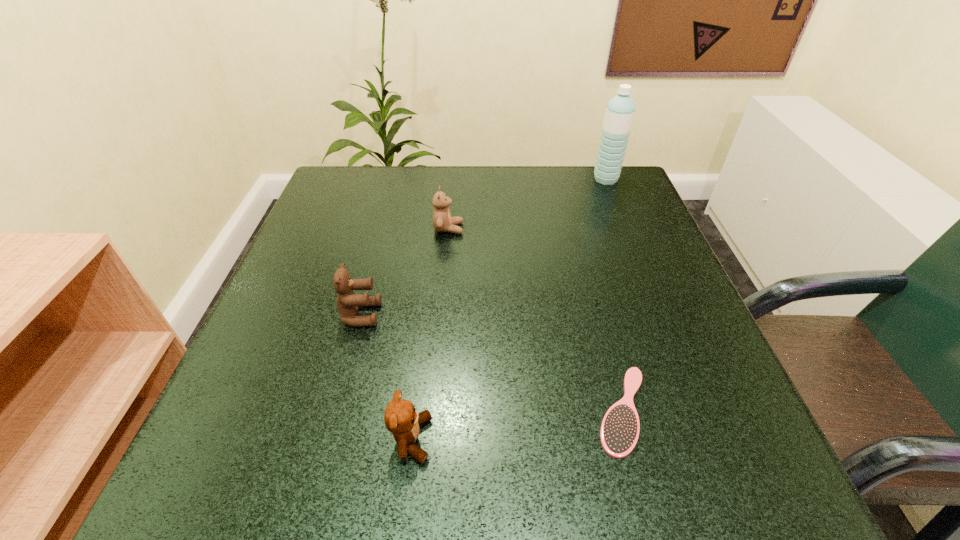
The height and width of the screenshot is (540, 960). I want to click on the rightmost object, so click(x=620, y=110).

Locate an element on the screen. This screenshot has height=540, width=960. water bottle is located at coordinates click(620, 110).

Where is `the second farthest teddy bear`? The height and width of the screenshot is (540, 960). the second farthest teddy bear is located at coordinates (347, 301).

Identify the location of the leftmost teddy bear. (347, 301).

Image resolution: width=960 pixels, height=540 pixels. I want to click on the farthest teddy bear, so click(442, 221).

Locate an element on the screen. The height and width of the screenshot is (540, 960). the nearest teddy bear is located at coordinates (400, 418).

Locate an element on the screen. The width and height of the screenshot is (960, 540). the second object from right to left is located at coordinates (619, 432).

You are a GUI agent. You are given a task and a screenshot of the screen. Output one action in this format:
    pyautogui.click(x=<x>, y=<y>)
    Task: Click on the hairbrush
    
    Given the screenshot: What is the action you would take?
    pyautogui.click(x=619, y=432)

Find the location of a particular element. The image size is (960, 540). free space located on the left of the water bottle is located at coordinates (574, 179).

This screenshot has width=960, height=540. In order to click on vacant position located 0.320m on the face of the leftmost object in this screenshot , I will do `click(558, 314)`.